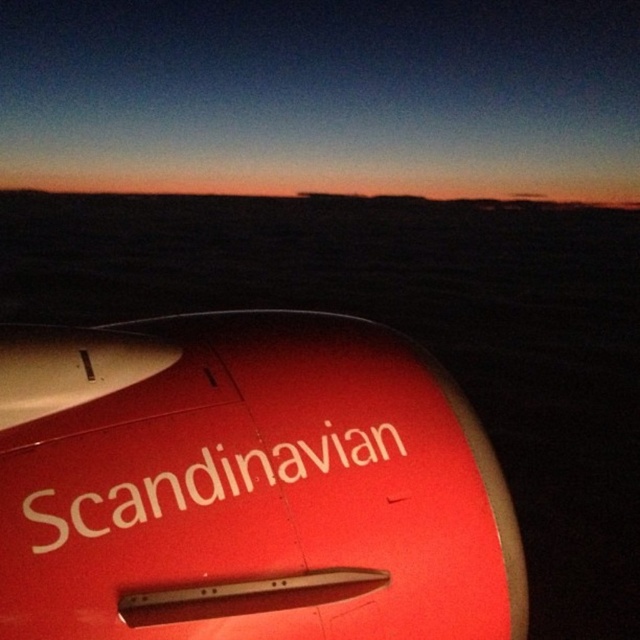
Between matte red airplane at center and matte red airplane wing at upper left, which one is positioned higher?

matte red airplane at center is higher up.

Can you confirm if matte red airplane at center is taller than matte red airplane wing at upper left?

Yes.

Which is in front, point (54, 326) or point (61, 502)?

Point (61, 502) is in front.

I want to click on matte red airplane at center, so click(246, 484).